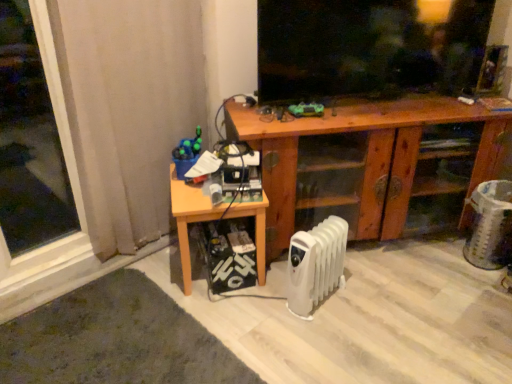
Where is `black matte screen at upper center`? The height and width of the screenshot is (384, 512). black matte screen at upper center is located at coordinates (369, 47).

What do you see at coordinates (315, 265) in the screenshot? Image resolution: width=512 pixels, height=384 pixels. I see `white plastic radiator at lower center` at bounding box center [315, 265].

Locate an element on the screen. The height and width of the screenshot is (384, 512). transparent glass window at left is located at coordinates (36, 155).

Describe the element at coordinates (128, 107) in the screenshot. I see `beige fabric curtain at left` at that location.

Identify the location of black matte screen at upper center. The height and width of the screenshot is (384, 512). click(x=369, y=47).

Which is correct: transparent glass window at left is inside white plastic radiator at lower center, or outside of it?

The correct answer is: outside.

Can you confirm if transparent glass window at left is positioned to the left of white plastic radiator at lower center?

Yes, transparent glass window at left is to the left of white plastic radiator at lower center.

Consider the image. From a real-world perspective, which is physically below, beige fabric curtain at left or black matte screen at upper center?

beige fabric curtain at left, from a real-world perspective.

Can you confirm if beige fabric curtain at left is shorter than black matte screen at upper center?

Incorrect, the height of beige fabric curtain at left does not fall short of that of black matte screen at upper center.

Is black matte screen at upper center completely or partially inside beige fabric curtain at left?

Actually, black matte screen at upper center is outside beige fabric curtain at left.

Is point (91, 154) behind point (406, 23)?

No, it is not.

Between white plastic radiator at lower center and wooden table at lower left, which one is positioned behind?

wooden table at lower left is further away from the camera.

Considering the relative sizes of white plastic radiator at lower center and wooden table at lower left in the image provided, is white plastic radiator at lower center taller than wooden table at lower left?

No.

How different are the orientations of white plastic radiator at lower center and wooden table at lower left in degrees?

36.5 degrees separate the facing orientations of white plastic radiator at lower center and wooden table at lower left.

Is white plastic radiator at lower center outside of wooden table at lower left?

white plastic radiator at lower center lies outside wooden table at lower left's area.

Is wooden table at lower left at the back of transparent glass window at left?

No, transparent glass window at left is not facing the opposite direction of wooden table at lower left.

From the picture: How distant is transparent glass window at left from wooden table at lower left?

They are 1.32 meters apart.

Is wooden table at lower left a part of transparent glass window at left?

That's incorrect, wooden table at lower left is not inside transparent glass window at left.

In the scene shown: From the image's perspective, is transparent glass window at left located beneath wooden table at lower left?

Actually, transparent glass window at left appears above wooden table at lower left in the image.

Can you tell me how much black matte screen at upper center and transparent glass window at left differ in facing direction?

28.6 degrees.

Is black matte screen at upper center aimed at transparent glass window at left?

No, black matte screen at upper center does not turn towards transparent glass window at left.

Between black matte screen at upper center and transparent glass window at left, which one appears on the right side from the viewer's perspective?

black matte screen at upper center is more to the right.

From a real-world perspective, which object stands above the other?

black matte screen at upper center.

Considering the points (261, 268) and (300, 265), which point is behind, point (261, 268) or point (300, 265)?

The point (261, 268) is behind.

How different are the orientations of wooden table at lower left and white plastic radiator at lower center in degrees?

wooden table at lower left and white plastic radiator at lower center are facing 36.5 degrees away from each other.

Considering the sizes of objects wooden table at lower left and white plastic radiator at lower center in the image provided, who is taller, wooden table at lower left or white plastic radiator at lower center?

wooden table at lower left is taller.

Is wooden table at lower left far away from white plastic radiator at lower center?

No.

Looking at this image, is the position of beige fabric curtain at left less distant than that of wooden cabinet at center?

That is True.

Is point (94, 197) farther from camera compared to point (395, 205)?

No, (94, 197) is closer to viewer.

Locate an element on the screen. The height and width of the screenshot is (384, 512). curtain that appears on the left of wooden cabinet at center is located at coordinates (128, 107).

From a real-world perspective, is beige fabric curtain at left on wooden cabinet at center?

Yes, from a real-world perspective, beige fabric curtain at left is above wooden cabinet at center.

This screenshot has height=384, width=512. In order to click on window lying in front of the white plastic radiator at lower center in this screenshot , I will do `click(36, 155)`.

I want to click on window screen behind the beige fabric curtain at left, so click(369, 47).

Considering their positions, is white plastic radiator at lower center positioned closer to black matte screen at upper center than wooden cabinet at center?

wooden cabinet at center lies closer to black matte screen at upper center than the other object.

Looking at the image, which one is located further to wooden cabinet at center, black matte screen at upper center or wooden table at lower left?

wooden table at lower left.

When comparing their distances from wooden cabinet at center, does transparent glass window at left or black matte screen at upper center seem closer?

The object closer to wooden cabinet at center is black matte screen at upper center.

Considering their positions, is wooden table at lower left positioned closer to transparent glass window at left than white plastic radiator at lower center?

Among the two, wooden table at lower left is located nearer to transparent glass window at left.

Considering their positions, is transparent glass window at left positioned closer to beige fabric curtain at left than wooden table at lower left?

Among the two, wooden table at lower left is located nearer to beige fabric curtain at left.

Looking at this image, when comparing their distances from black matte screen at upper center, does beige fabric curtain at left or transparent glass window at left seem closer?

Among the two, beige fabric curtain at left is located nearer to black matte screen at upper center.

Consider the image. Which object lies nearer to the anchor point black matte screen at upper center, wooden table at lower left or transparent glass window at left?

wooden table at lower left lies closer to black matte screen at upper center than the other object.

Which object lies nearer to the anchor point transparent glass window at left, white plastic radiator at lower center or black matte screen at upper center?

white plastic radiator at lower center is positioned closer to the anchor transparent glass window at left.

At what (x,y) coordinates should I click in order to perform the action: click on table between transparent glass window at left and black matte screen at upper center in the horizontal direction. Please return your answer as a coordinate pair (x, y). This screenshot has height=384, width=512. Looking at the image, I should click on (212, 220).

Where is `radiator located between wooden table at lower left and wooden cabinet at center in the left-right direction`? radiator located between wooden table at lower left and wooden cabinet at center in the left-right direction is located at coordinates (315, 265).

Find the location of a particular element. The image size is (512, 384). window screen between beige fabric curtain at left and wooden cabinet at center from left to right is located at coordinates (369, 47).

Identify the location of radiator between transparent glass window at left and black matte screen at upper center from left to right. This screenshot has height=384, width=512. (315, 265).